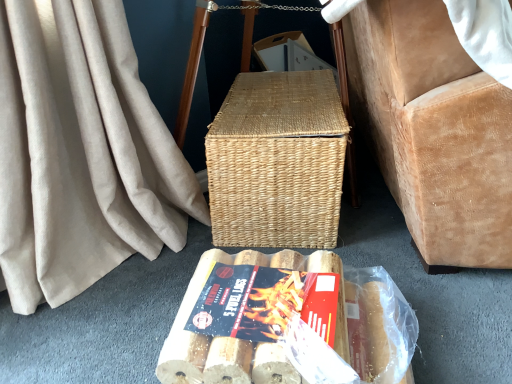
Where is `vacant space situated above wooden textured logs at center (from a real-world perspective)`? The image size is (512, 384). vacant space situated above wooden textured logs at center (from a real-world perspective) is located at coordinates (267, 302).